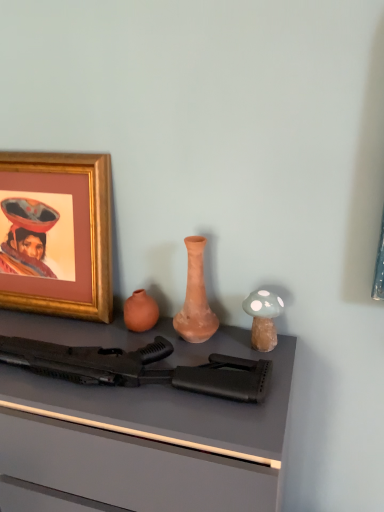
Question: From a real-world perspective, does matte black rifle at center sit lower than matte clay vase at center?

Choices:
 (A) yes
 (B) no

Answer: (A)

Question: Can you confirm if matte black rifle at center is smaller than matte clay vase at center?

Choices:
 (A) no
 (B) yes

Answer: (A)

Question: Can you confirm if matte black rifle at center is bigger than matte clay vase at center?

Choices:
 (A) no
 (B) yes

Answer: (B)

Question: Does matte black rifle at center appear on the right side of matte clay vase at center?

Choices:
 (A) no
 (B) yes

Answer: (A)

Question: Considering the relative positions of matte black rifle at center and matte clay vase at center in the image provided, is matte black rifle at center to the left of matte clay vase at center from the viewer's perspective?

Choices:
 (A) no
 (B) yes

Answer: (B)

Question: From the image's perspective, is matte black rifle at center beneath matte clay vase at center?

Choices:
 (A) no
 (B) yes

Answer: (B)

Question: Could you tell me if black matte rifle at center is turned towards gold-framed picture at upper left?

Choices:
 (A) no
 (B) yes

Answer: (A)

Question: Is black matte rifle at center placed right next to gold-framed picture at upper left?

Choices:
 (A) no
 (B) yes

Answer: (A)

Question: Does black matte rifle at center have a greater width compared to gold-framed picture at upper left?

Choices:
 (A) yes
 (B) no

Answer: (A)

Question: Could gold-framed picture at upper left be considered to be inside black matte rifle at center?

Choices:
 (A) yes
 (B) no

Answer: (B)

Question: Is black matte rifle at center positioned with its back to gold-framed picture at upper left?

Choices:
 (A) yes
 (B) no

Answer: (B)

Question: Does black matte rifle at center have a lesser height compared to gold-framed picture at upper left?

Choices:
 (A) yes
 (B) no

Answer: (A)

Question: Considering the relative positions of matte clay vase at center and gold-framed picture at upper left in the image provided, is matte clay vase at center in front of gold-framed picture at upper left?

Choices:
 (A) no
 (B) yes

Answer: (B)